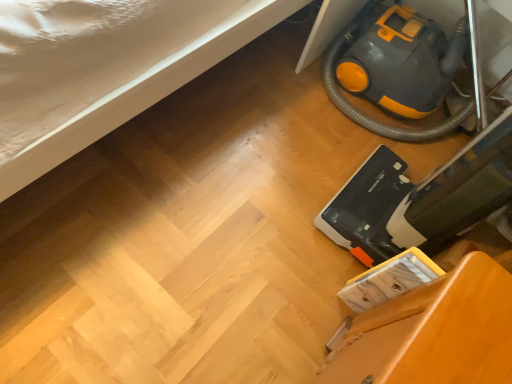
Locate an element on the screen. The width and height of the screenshot is (512, 384). blank space to the left of yellow-orange plastic vacuum cleaner at lower right, which is counted as the second equipment, starting from the front is located at coordinates (259, 80).